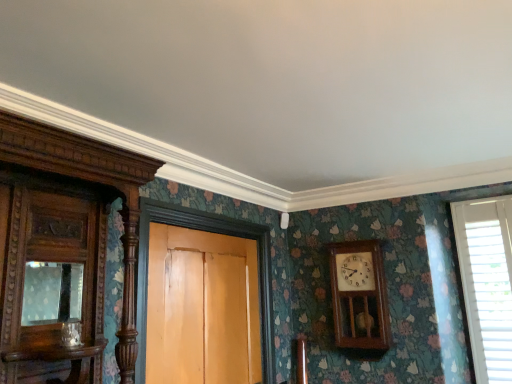
Question: From a real-world perspective, relative to wooden door at center, is white plastic blinds at right vertically above or below?

Choices:
 (A) above
 (B) below

Answer: (A)

Question: In the image, is white plastic blinds at right on the left side or the right side of wooden door at center?

Choices:
 (A) left
 (B) right

Answer: (B)

Question: Which is farther from the wooden door at center?

Choices:
 (A) matte glass mirror at left
 (B) polished wood cabinet at left
 (C) white plastic blinds at right
 (D) wooden wall clock at center-right

Answer: (C)

Question: Estimate the real-world distances between objects in this image. Which object is farther from the polished wood cabinet at left?

Choices:
 (A) matte glass mirror at left
 (B) wooden door at center
 (C) wooden wall clock at center-right
 (D) white plastic blinds at right

Answer: (D)